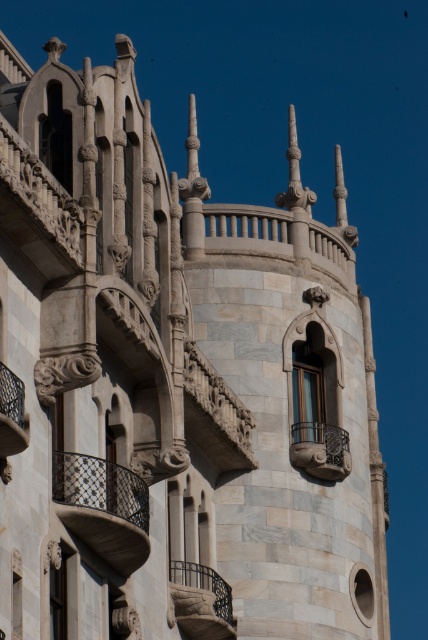
Question: Estimate the real-world distances between objects in this image. Which object is farther from the marble stone balcony at center?

Choices:
 (A) carved stone balcony at lower center
 (B) dark gray wrought iron balcony at center left

Answer: (B)

Question: Is dark gray wrought iron balcony at center left to the left of carved stone balcony at lower center from the viewer's perspective?

Choices:
 (A) yes
 (B) no

Answer: (A)

Question: Does carved stone balcony at lower center have a greater width compared to marble stone balcony at center?

Choices:
 (A) no
 (B) yes

Answer: (A)

Question: Which of the following is the closest to the observer?

Choices:
 (A) (20, 436)
 (B) (213, 572)
 (C) (314, 460)

Answer: (A)

Question: Can you confirm if marble stone balcony at center is positioned above polished metal balcony at lower left?

Choices:
 (A) no
 (B) yes

Answer: (A)

Question: Which object is closer to the camera taking this photo?

Choices:
 (A) carved stone balcony at lower center
 (B) polished metal balcony at lower left
 (C) dark gray wrought iron balcony at center left

Answer: (B)